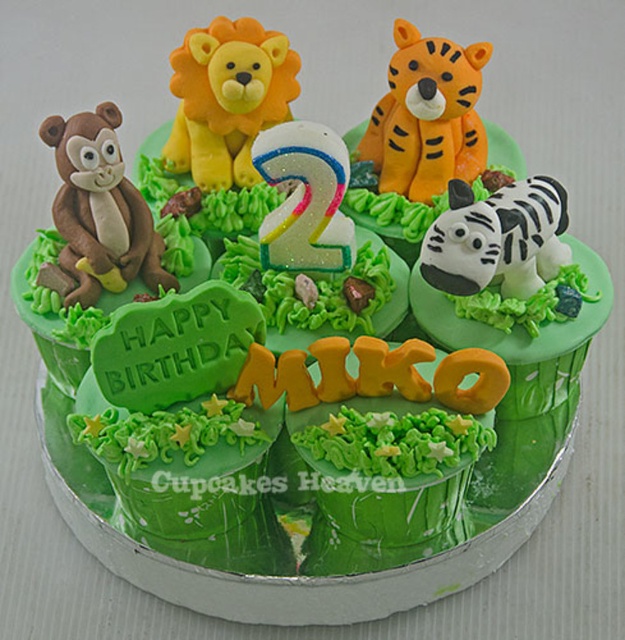
Question: Which point is closer to the camera taking this photo?

Choices:
 (A) (398, 177)
 (B) (471, 259)
 (C) (262, 58)
 (D) (68, 157)

Answer: (B)

Question: Is yellow fondant lion at upper center closer to the viewer compared to orange matte tiger at upper right?

Choices:
 (A) yes
 (B) no

Answer: (B)

Question: Is orange matte tiger at upper right wider than white matte tiger at upper right?

Choices:
 (A) yes
 (B) no

Answer: (B)

Question: Does orange matte tiger at upper right have a lesser width compared to white matte tiger at upper right?

Choices:
 (A) yes
 (B) no

Answer: (A)

Question: Which of the following is the farthest from the observer?

Choices:
 (A) yellow fondant lion at upper center
 (B) white matte tiger at upper right
 (C) orange matte tiger at upper right
 (D) matte brown monkey at left

Answer: (A)

Question: Considering the real-world distances, which object is farthest from the white matte tiger at upper right?

Choices:
 (A) yellow fondant lion at upper center
 (B) matte brown monkey at left
 (C) orange matte tiger at upper right

Answer: (B)